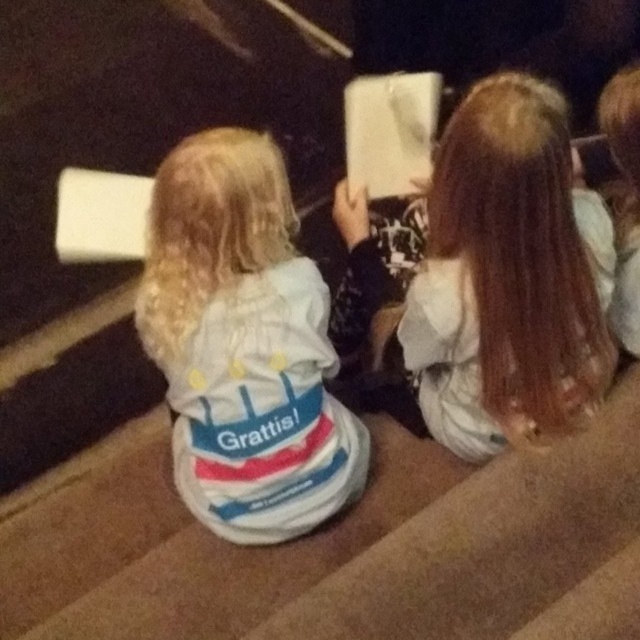
Question: Is white soft hoodie at center further to camera compared to smooth brown hair at center?

Choices:
 (A) yes
 (B) no

Answer: (A)

Question: Can you confirm if white soft hoodie at center is wider than smooth brown hair at center?

Choices:
 (A) yes
 (B) no

Answer: (A)

Question: Does white soft hoodie at center appear on the right side of smooth brown hair at center?

Choices:
 (A) yes
 (B) no

Answer: (B)

Question: Among these objects, which one is nearest to the camera?

Choices:
 (A) white soft hoodie at center
 (B) smooth brown hair at center

Answer: (B)

Question: Which object is farther from the camera taking this photo?

Choices:
 (A) white soft hoodie at center
 (B) smooth brown hair at center

Answer: (A)

Question: Which of the following is the farthest from the observer?

Choices:
 (A) (282, 284)
 (B) (548, 131)

Answer: (A)